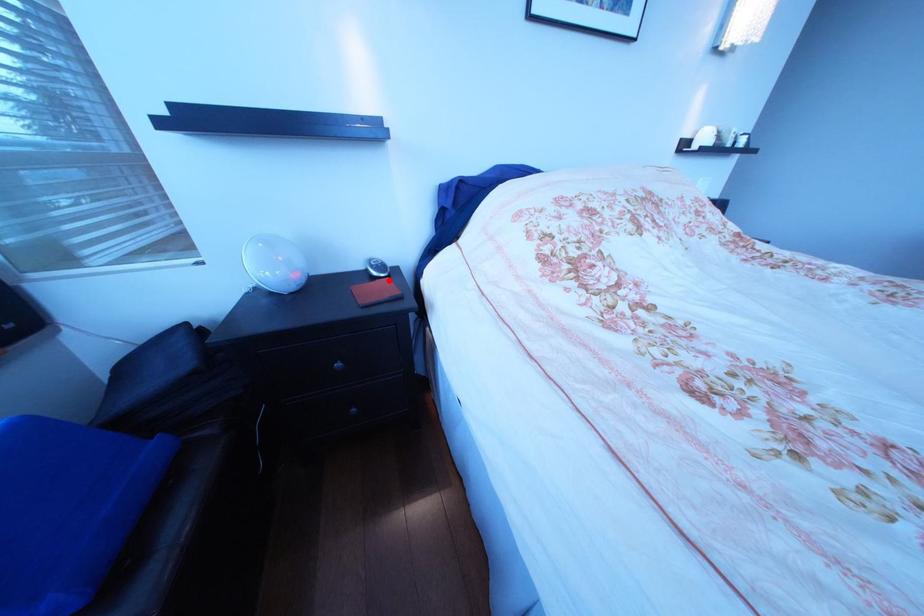
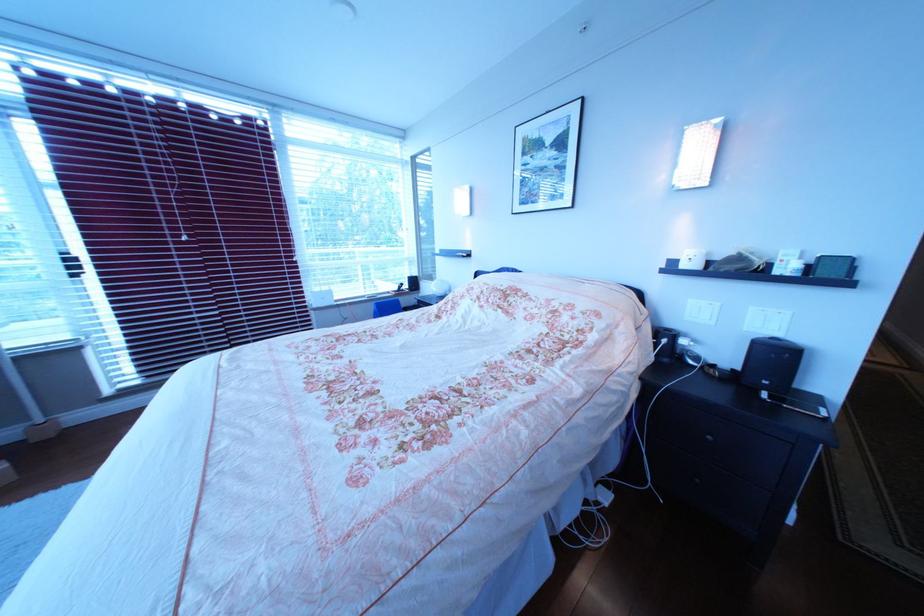
Question: I am providing you with two images of the same scene from different viewpoints. A red point is marked on the first image. Is the red point's position out of view in image 2?

Choices:
 (A) Yes
 (B) No

Answer: (A)